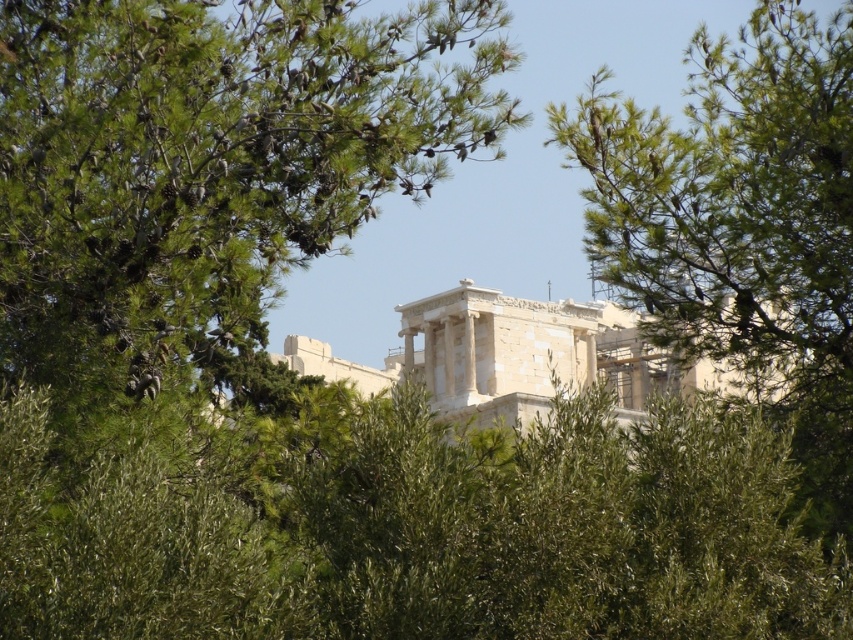
Does green pinecone at center have a larger size compared to green leafy tree at upper right?

Indeed, green pinecone at center has a larger size compared to green leafy tree at upper right.

At what (x,y) coordinates should I click in order to perform the action: click on green pinecone at center. Please return your answer as a coordinate pair (x, y). Looking at the image, I should click on click(209, 166).

You are a GUI agent. You are given a task and a screenshot of the screen. Output one action in this format:
    pyautogui.click(x=<x>, y=<y>)
    Task: Click on the green pinecone at center
    
    Given the screenshot: What is the action you would take?
    pyautogui.click(x=209, y=166)